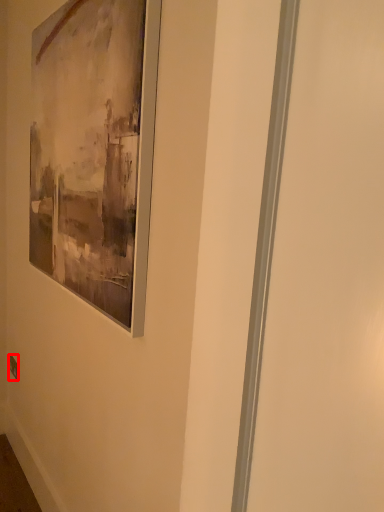
Question: From the image's perspective, considering the relative positions of electric outlet (annotated by the red box) and picture frame in the image provided, where is electric outlet (annotated by the red box) located with respect to the staircase?

Choices:
 (A) below
 (B) above

Answer: (A)